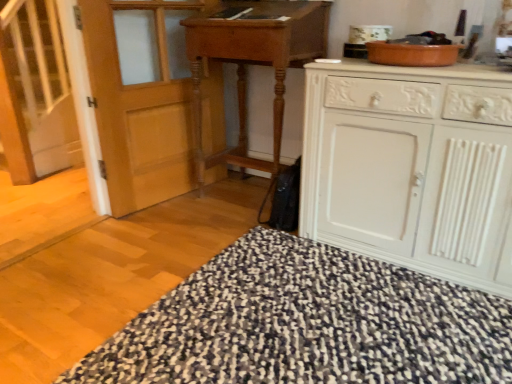
Question: From a real-world perspective, is white wooden stairs at left physically located above or below white painted wood cabinet at right?

Choices:
 (A) above
 (B) below

Answer: (A)

Question: Based on their sizes in the image, would you say white wooden stairs at left is bigger or smaller than white painted wood cabinet at right?

Choices:
 (A) small
 (B) big

Answer: (A)

Question: Which object is the closest to the wooden table at center?

Choices:
 (A) black textured rug at lower center
 (B) white painted wood cabinet at right
 (C) white wooden stairs at left

Answer: (B)

Question: Estimate the real-world distances between objects in this image. Which object is closer to the wooden table at center?

Choices:
 (A) black textured rug at lower center
 (B) white wooden stairs at left
 (C) white painted wood cabinet at right

Answer: (C)